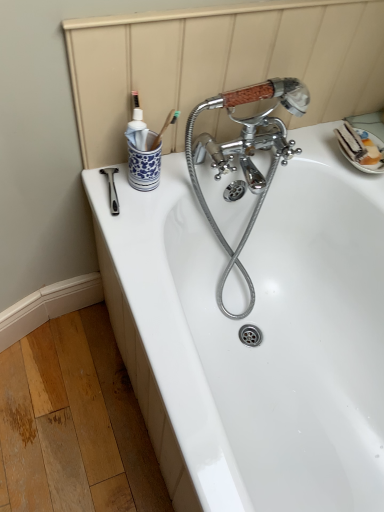
Describe the element at coordinates (254, 323) in the screenshot. I see `white glossy bathtub at upper left` at that location.

The width and height of the screenshot is (384, 512). Identify the location of white glossy bathtub at upper left. [x=254, y=323].

This screenshot has height=512, width=384. In order to click on white glossy bathtub at upper left in this screenshot , I will do `click(254, 323)`.